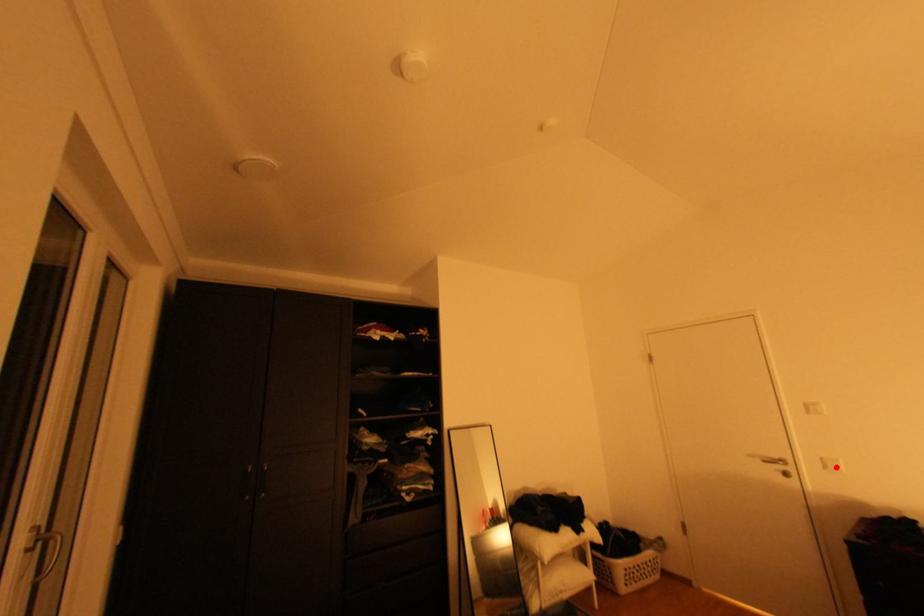
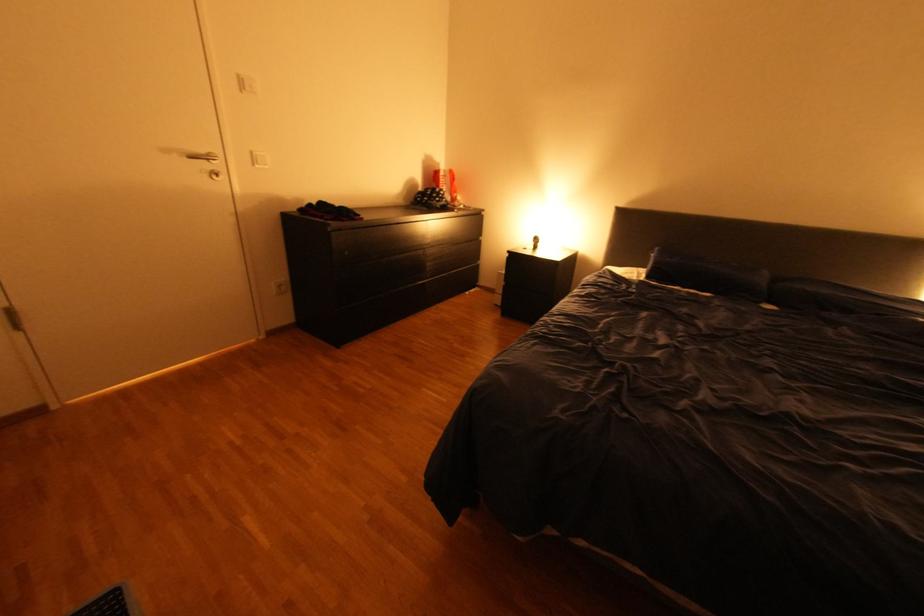
Question: I am providing you with two images of the same scene from different viewpoints. In image1, a red point is highlighted. Considering the same 3D point in image2, which of the following is correct?

Choices:
 (A) It is closer
 (B) It is farther

Answer: (B)